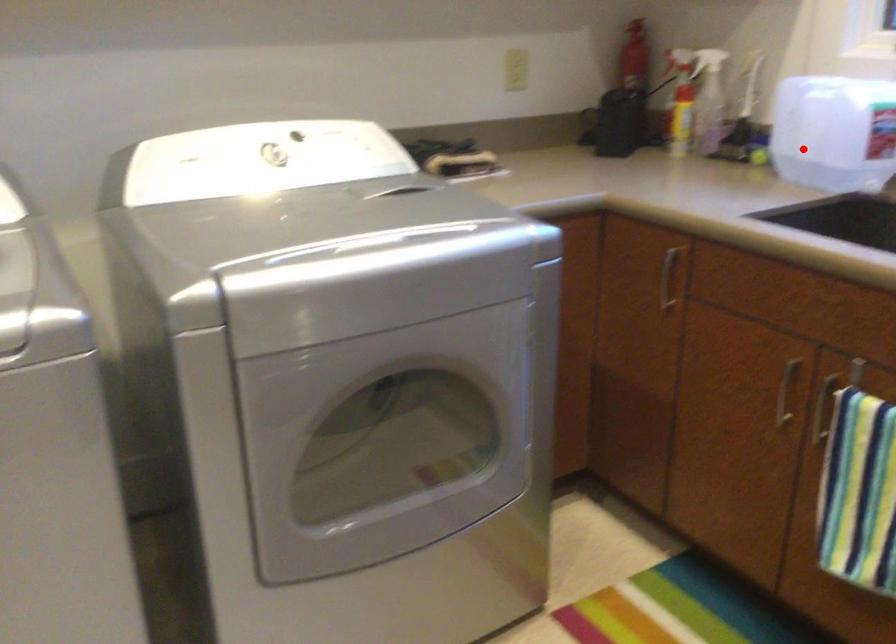
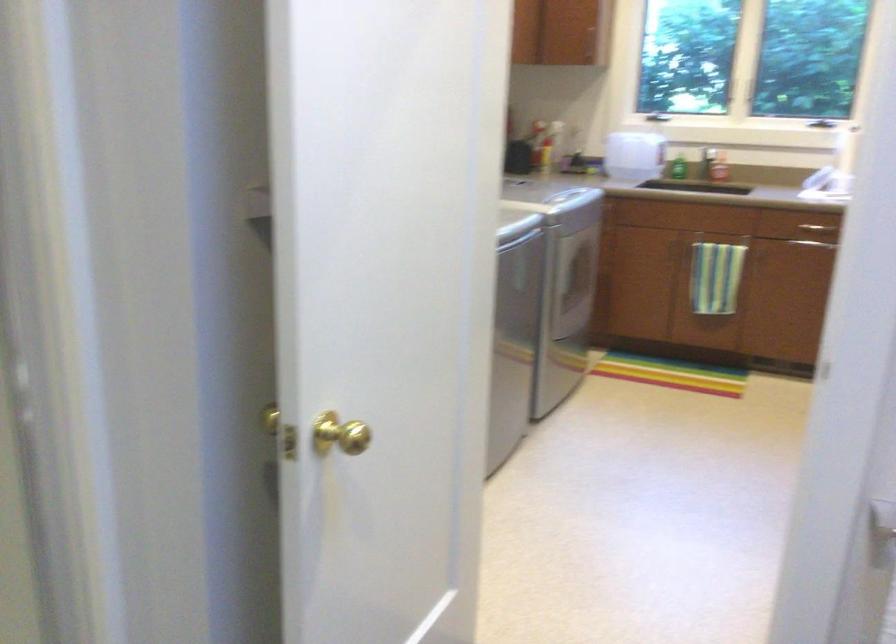
The point at the highlighted location is marked in the first image. Where is the corresponding point in the second image?

(633, 155)